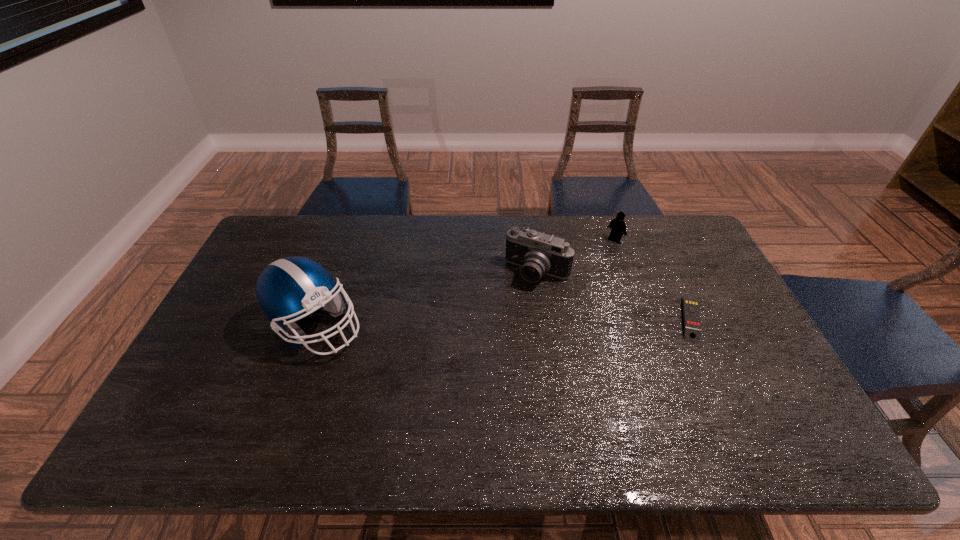
The height and width of the screenshot is (540, 960). In the image, there is a desktop. In order to click on free space at the far edge in this screenshot , I will do `click(588, 233)`.

You are a GUI agent. You are given a task and a screenshot of the screen. Output one action in this format:
    pyautogui.click(x=<x>, y=<y>)
    Task: Click on the free space at the left edge of the desktop
    
    Given the screenshot: What is the action you would take?
    pyautogui.click(x=240, y=365)

This screenshot has height=540, width=960. I want to click on free space at the right edge of the desktop, so click(708, 351).

Identify the location of vacant point at the far left corner. click(269, 232).

The image size is (960, 540). Find the location of `vacant region at the near left corner of the desktop`. vacant region at the near left corner of the desktop is located at coordinates (236, 390).

What are the coordinates of `free space at the far right corner of the desktop` in the screenshot? It's located at (678, 238).

At what (x,y) coordinates should I click in order to perform the action: click on vacant space that is in between the remote control and the second shortest object. Please return your answer as a coordinate pair (x, y). Looking at the image, I should click on (653, 279).

Identify the location of vacant space that's between the third object from right to left and the farthest object. (576, 255).

Image resolution: width=960 pixels, height=540 pixels. In order to click on vacant point located between the remote control and the camera in this screenshot , I will do `click(613, 296)`.

Identify the location of unoccupied area between the tallest object and the shortest object. (503, 323).